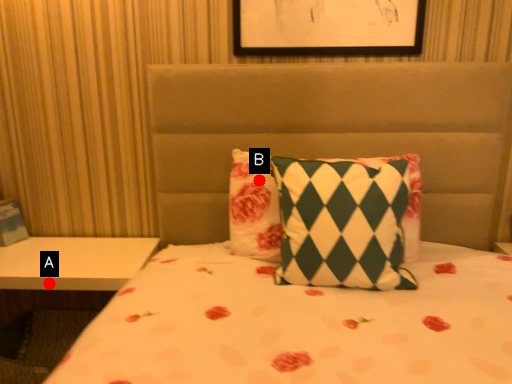
Question: Two points are circled on the image, labeled by A and B beside each circle. Which point is farther from the camera taking this photo?

Choices:
 (A) A is further
 (B) B is further

Answer: (A)